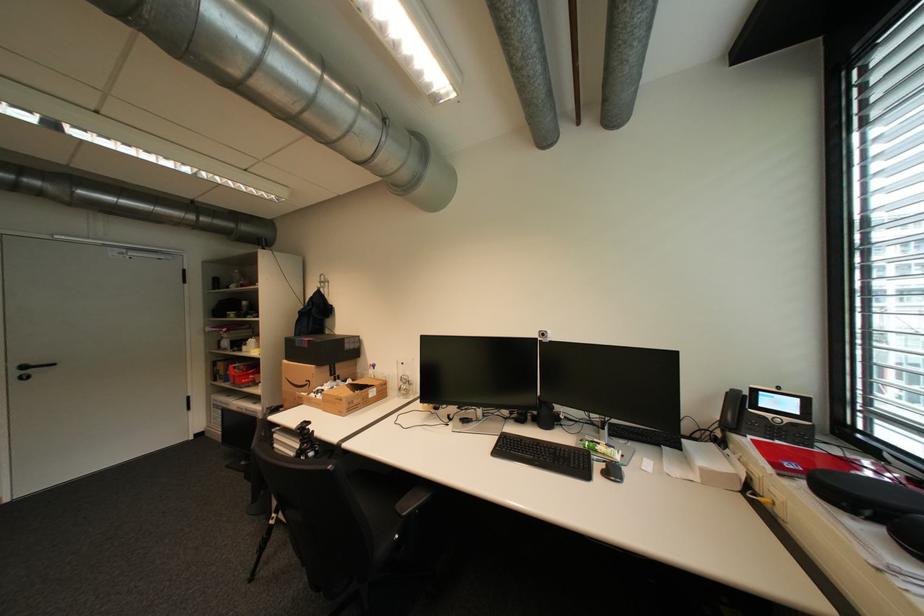
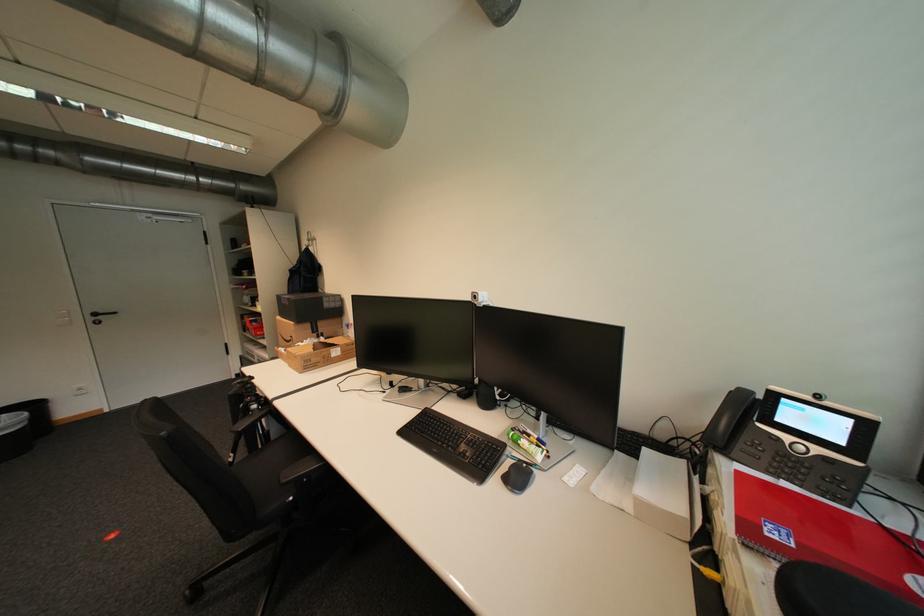
Locate, in the second image, the point that corresponds to the point at 314,347 in the first image.

(296, 305)